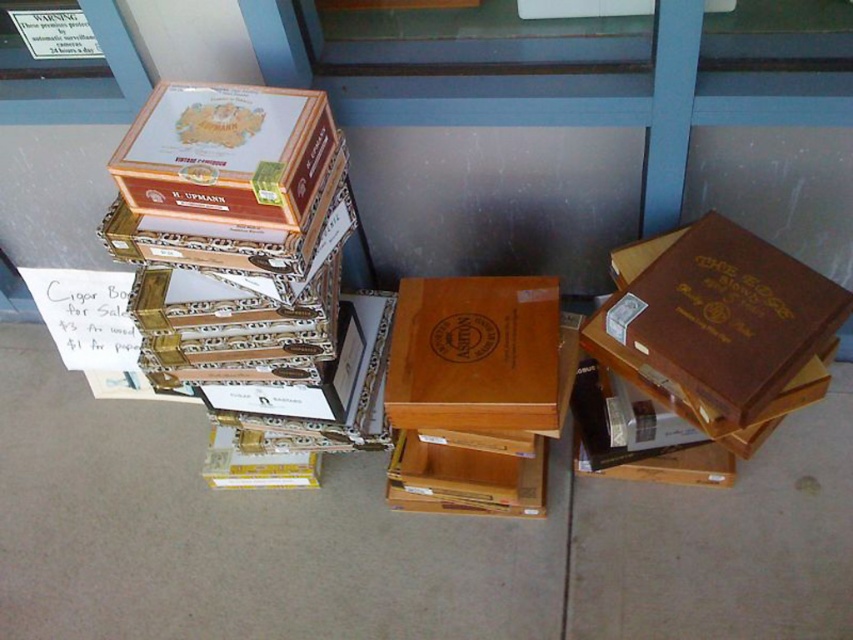
Question: Where is brown cardboard boxes at center located in relation to matte brown wooden box at center in the image?

Choices:
 (A) above
 (B) below

Answer: (B)

Question: Which object appears farthest from the camera in this image?

Choices:
 (A) brown leather book at right
 (B) brown cardboard boxes at center

Answer: (B)

Question: From the image, what is the correct spatial relationship of brown leather book at right in relation to matte brown cigar box at upper left?

Choices:
 (A) below
 (B) above

Answer: (A)

Question: Among these objects, which one is farthest from the camera?

Choices:
 (A) brown leather book at right
 (B) matte brown cigar box at upper left
 (C) wooden box at center

Answer: (C)

Question: Can you confirm if matte brown cigar box at upper left is positioned to the right of wooden box at center?

Choices:
 (A) no
 (B) yes

Answer: (A)

Question: Which point appears farthest from the camera in this image?

Choices:
 (A) (218, 166)
 (B) (466, 493)

Answer: (B)